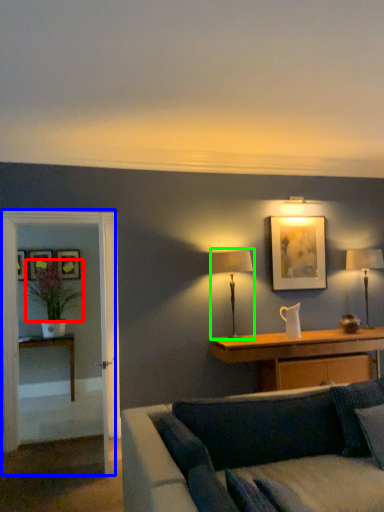
Question: Which object is the closest to the flower (highlighted by a red box)? Choose among these: glass door (highlighted by a blue box) or table lamp (highlighted by a green box).

Choices:
 (A) glass door
 (B) table lamp

Answer: (A)